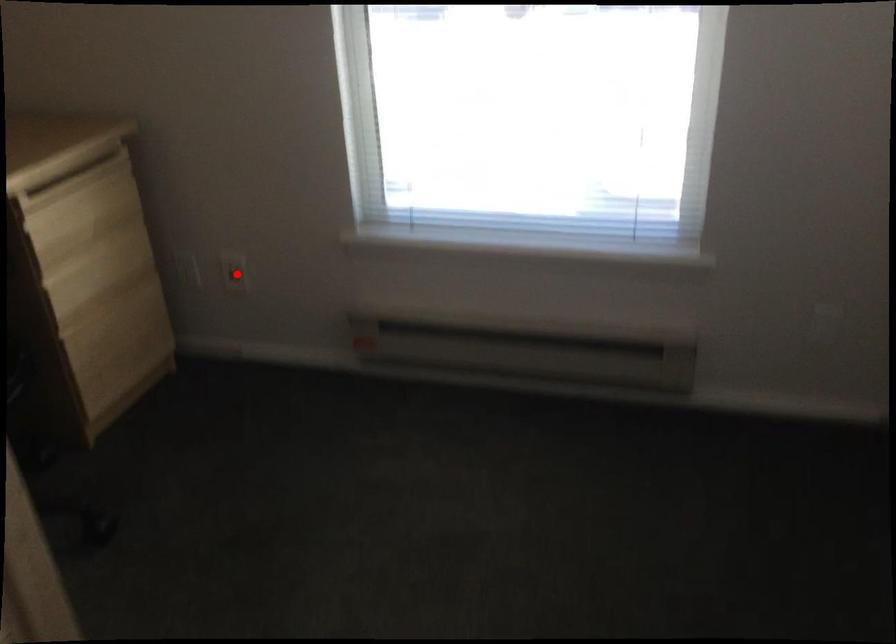
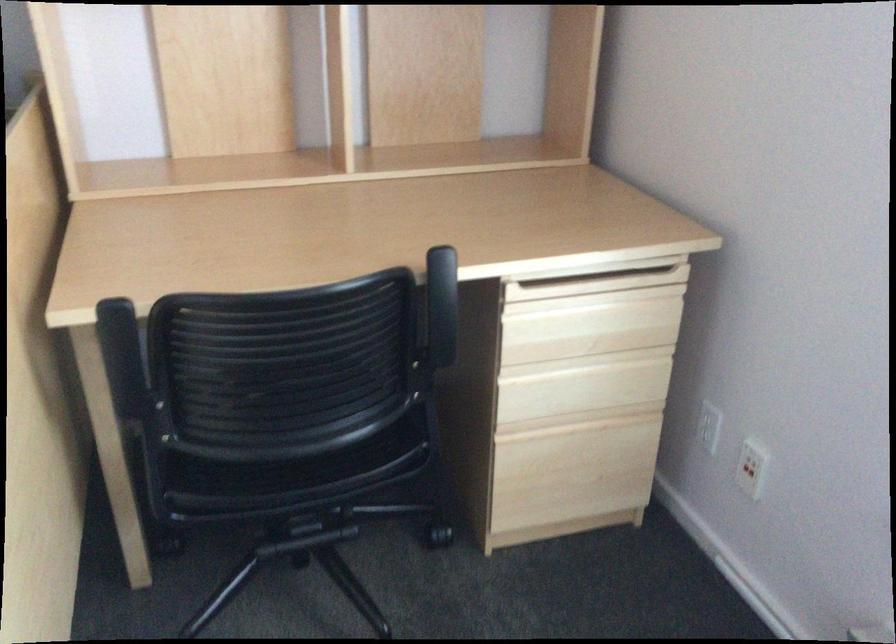
Question: I am providing you with two images of the same scene from different viewpoints. Image1 has a red point marked. In image2, the corresponding 3D location appears at what relative position? Reply with the corresponding letter.

Choices:
 (A) Closer
 (B) Farther

Answer: (A)